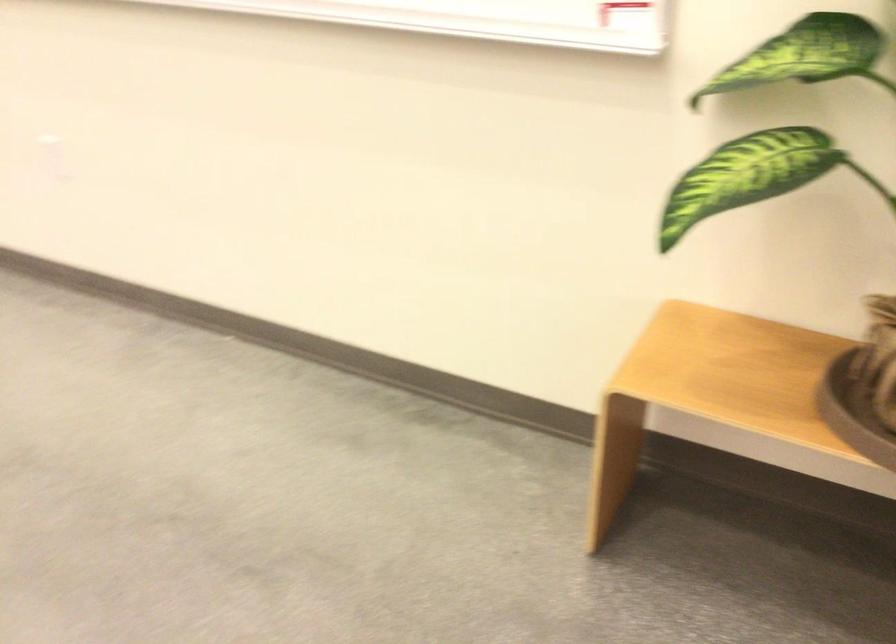
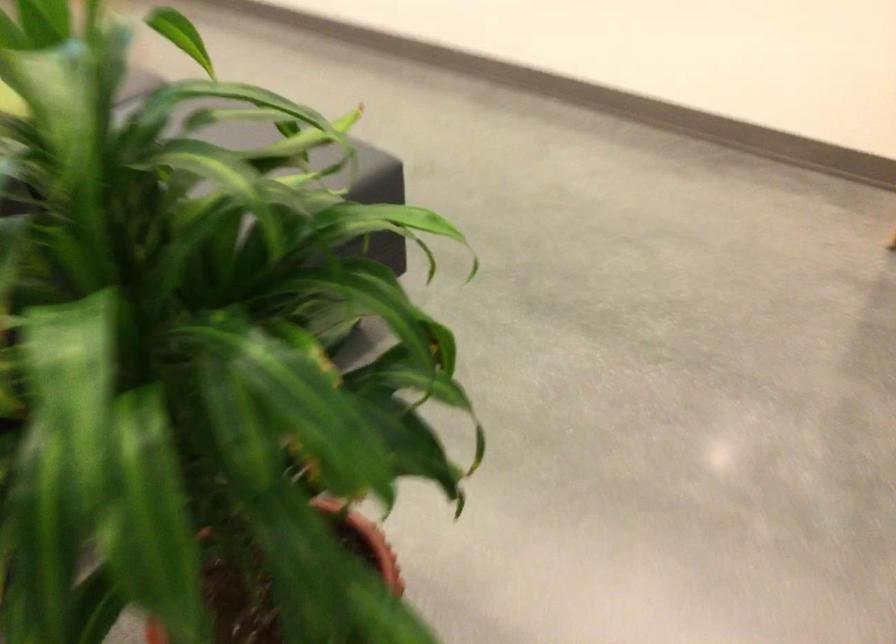
Which direction would the cameraman need to move to produce the second image?

The cameraman moved toward left, backward.